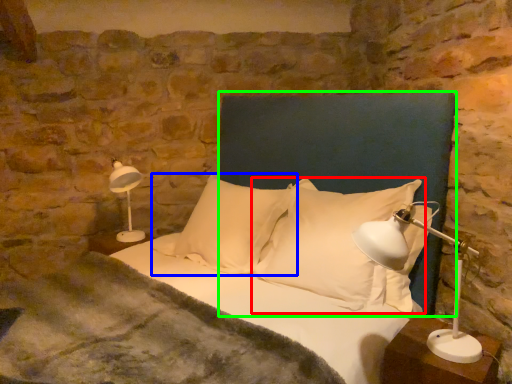
Question: Based on their relative distances, which object is farther from pillow (highlighted by a red box)? Choose from pillow (highlighted by a blue box) and headboard (highlighted by a green box).

Choices:
 (A) pillow
 (B) headboard

Answer: (B)